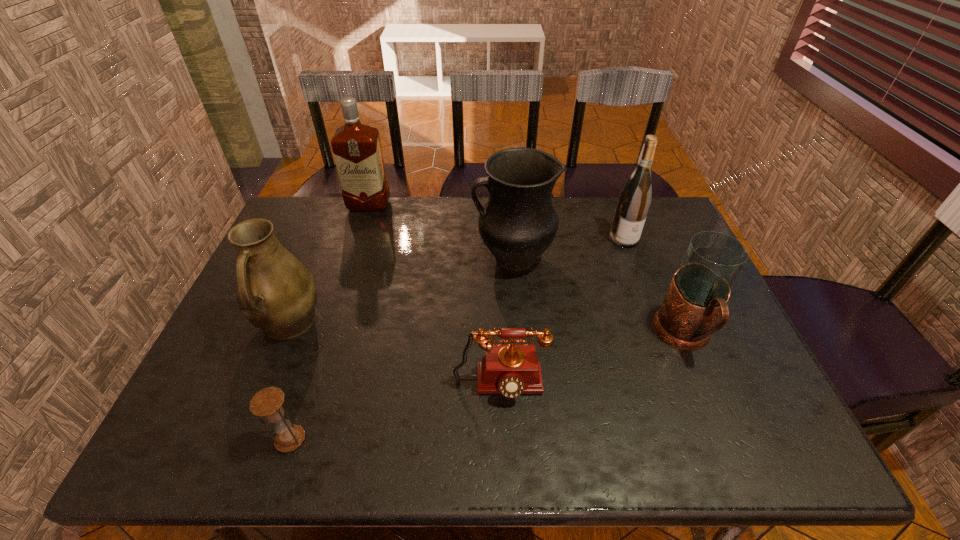
This screenshot has height=540, width=960. In order to click on the farthest object in this screenshot , I will do `click(356, 147)`.

Locate an element on the screen. wine bottle is located at coordinates (634, 200).

This screenshot has width=960, height=540. Find the location of `the farthest pitcher`. the farthest pitcher is located at coordinates (518, 223).

Find the location of a particular element. The width and height of the screenshot is (960, 540). the leftmost pitcher is located at coordinates (275, 292).

Locate an element on the screen. Image resolution: width=960 pixels, height=540 pixels. the rightmost pitcher is located at coordinates (699, 291).

The height and width of the screenshot is (540, 960). I want to click on the sixth tallest object, so (x=511, y=370).

The image size is (960, 540). Identify the location of hourglass. (268, 402).

Where is `the nearest object`? the nearest object is located at coordinates (268, 402).

Where is `free space located on the front label of the farthest object`? The image size is (960, 540). free space located on the front label of the farthest object is located at coordinates (361, 232).

Locate an element on the screen. The height and width of the screenshot is (540, 960). vacant region located 0.140m on the front of the wine bottle is located at coordinates (638, 280).